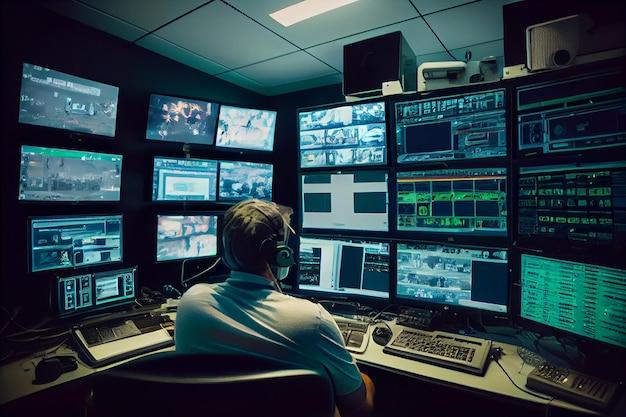
Find the location of `ceiling tiles`. ceiling tiles is located at coordinates (151, 10), (213, 28), (285, 78), (331, 24), (336, 53), (480, 27), (442, 2).